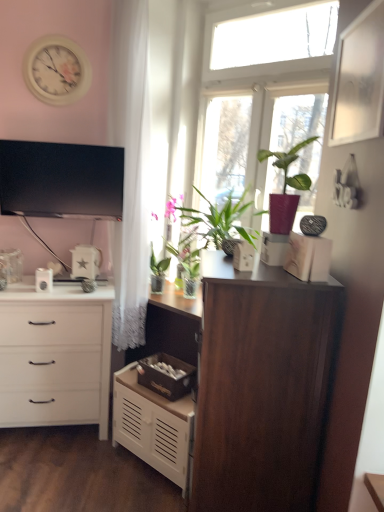
The width and height of the screenshot is (384, 512). In order to click on vacant point to the left of white glossy kettle at left, the first appliance when ordered from left to right in this screenshot , I will do `click(22, 282)`.